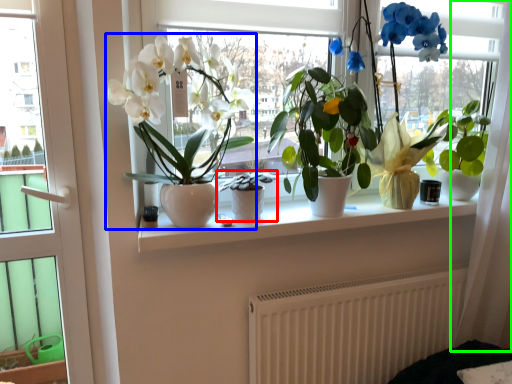
Question: Estimate the real-world distances between objects in this image. Which object is closer to houseplant (highlighted by a red box), houseplant (highlighted by a blue box) or curtain (highlighted by a green box)?

Choices:
 (A) houseplant
 (B) curtain

Answer: (A)